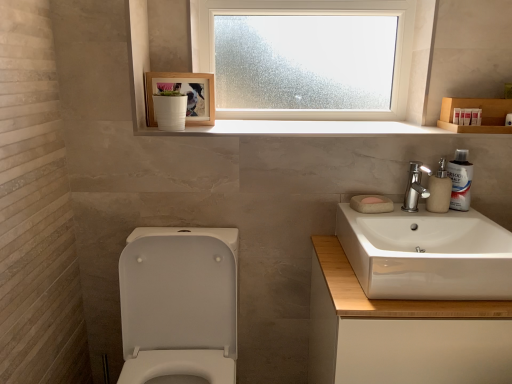
Question: Is white matte soap at sink bigger than frosted glass window at upper center?

Choices:
 (A) no
 (B) yes

Answer: (A)

Question: Is white matte soap at sink not inside frosted glass window at upper center?

Choices:
 (A) no
 (B) yes

Answer: (B)

Question: Does white matte soap at sink have a lesser height compared to frosted glass window at upper center?

Choices:
 (A) yes
 (B) no

Answer: (A)

Question: Is white matte soap at sink not close to frosted glass window at upper center?

Choices:
 (A) yes
 (B) no

Answer: (B)

Question: Does white matte soap at sink appear on the right side of frosted glass window at upper center?

Choices:
 (A) no
 (B) yes

Answer: (B)

Question: Is white matte soap at sink positioned behind frosted glass window at upper center?

Choices:
 (A) yes
 (B) no

Answer: (B)

Question: Is white matte soap at sink at the back of frosted glass window at upper center?

Choices:
 (A) yes
 (B) no

Answer: (B)

Question: From the image's perspective, is frosted glass window at upper center located above white matte soap at sink?

Choices:
 (A) yes
 (B) no

Answer: (A)

Question: Is frosted glass window at upper center to the right of white matte soap at sink from the viewer's perspective?

Choices:
 (A) yes
 (B) no

Answer: (B)

Question: Considering the relative sizes of frosted glass window at upper center and white matte soap at sink in the image provided, is frosted glass window at upper center thinner than white matte soap at sink?

Choices:
 (A) no
 (B) yes

Answer: (A)

Question: Is frosted glass window at upper center bigger than white matte soap at sink?

Choices:
 (A) yes
 (B) no

Answer: (A)

Question: Could you tell me if frosted glass window at upper center is facing white matte soap at sink?

Choices:
 (A) no
 (B) yes

Answer: (A)

Question: Would you say white wood shelf at upper center is part of white matte soap at sink's contents?

Choices:
 (A) yes
 (B) no

Answer: (B)